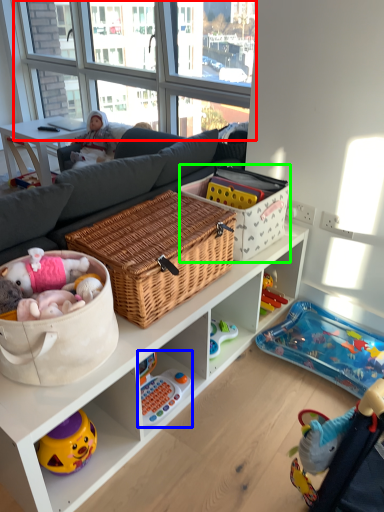
Question: Estimate the real-world distances between objects in this image. Which object is closer to window screen (highlighted by a red box), toy (highlighted by a blue box) or storage box (highlighted by a green box)?

Choices:
 (A) toy
 (B) storage box

Answer: (B)